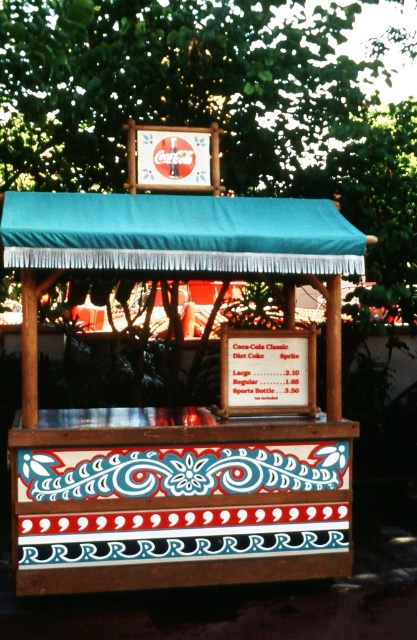
Question: Which object appears closest to the camera in this image?

Choices:
 (A) wooden at center
 (B) teal fabric canopy at upper center

Answer: (B)

Question: Where is wooden at center located in relation to teal fabric canopy at upper center in the image?

Choices:
 (A) right
 (B) left

Answer: (A)

Question: Which object appears farthest from the camera in this image?

Choices:
 (A) teal fabric canopy at upper center
 (B) wooden at center

Answer: (B)

Question: Observing the image, what is the correct spatial positioning of wooden at center in reference to teal fabric canopy at upper center?

Choices:
 (A) right
 (B) left

Answer: (A)

Question: Which point is closer to the camera?

Choices:
 (A) (228, 220)
 (B) (241, 400)

Answer: (A)

Question: Is wooden at center further to camera compared to teal fabric canopy at upper center?

Choices:
 (A) no
 (B) yes

Answer: (B)